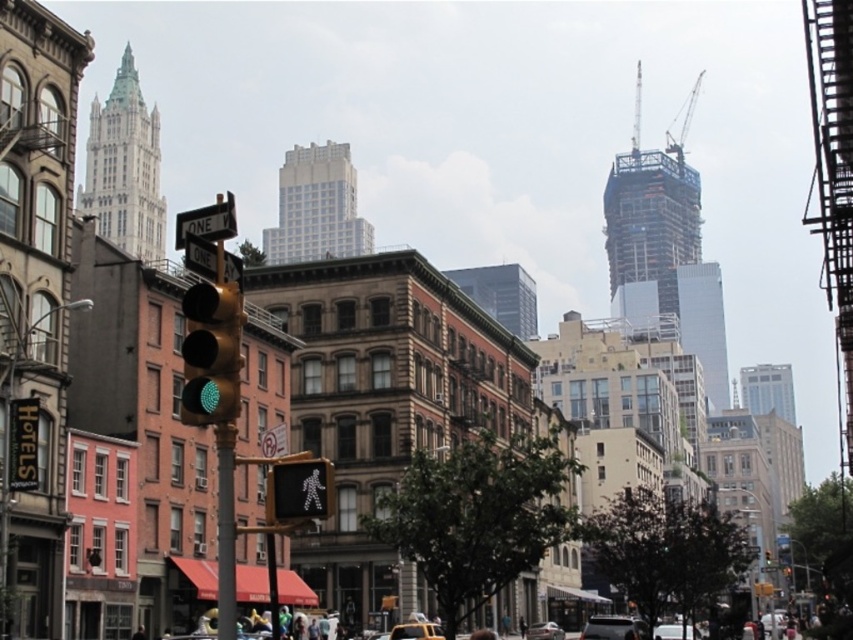
Question: Which of these objects is positioned closest to the translucent plastic pedestrian signal at center?

Choices:
 (A) green glass traffic light at center
 (B) metallic silver car at lower right

Answer: (A)

Question: Does translucent plastic pedestrian signal at center have a lesser width compared to metallic silver car at center?

Choices:
 (A) no
 (B) yes

Answer: (B)

Question: Considering the real-world distances, which object is farthest from the green glass traffic light at center?

Choices:
 (A) metallic silver car at lower center
 (B) yellow rubber taxi cab at center
 (C) translucent plastic pedestrian signal at center

Answer: (A)

Question: Is metallic silver car at lower center thinner than silver metallic sedan at lower center?

Choices:
 (A) yes
 (B) no

Answer: (B)

Question: Does green glass traffic light at center have a larger size compared to translucent plastic pedestrian signal at center?

Choices:
 (A) no
 (B) yes

Answer: (B)

Question: Which point appears closest to the camera in this image?

Choices:
 (A) tap(595, 614)
 (B) tap(764, 616)
 (C) tap(534, 628)
 (D) tap(190, 323)

Answer: (D)